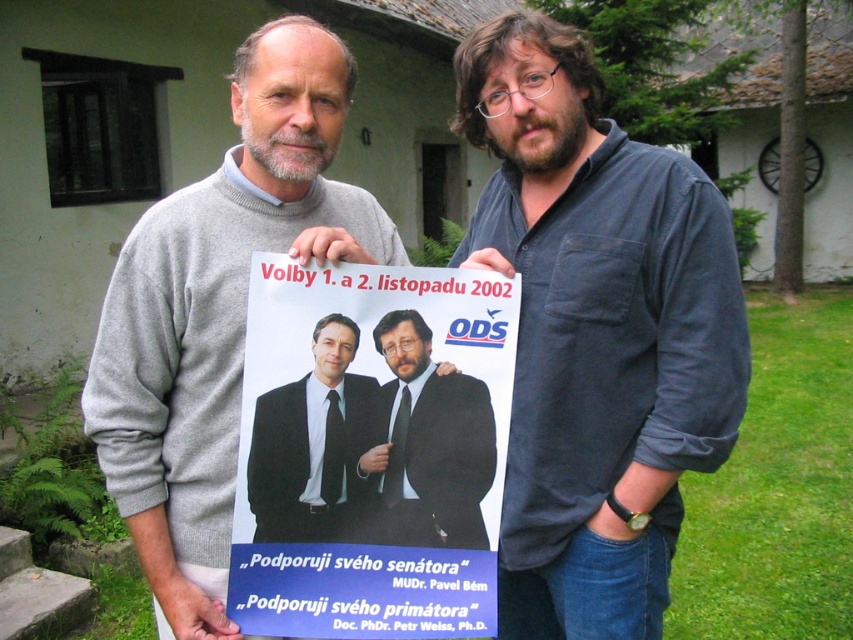
Question: Does blue paper poster at center have a larger size compared to gray sweater at center?

Choices:
 (A) no
 (B) yes

Answer: (A)

Question: Which object is closer to the camera taking this photo?

Choices:
 (A) matte black suit at center
 (B) black suit at center
 (C) gray sweater at center
 (D) blue paper poster at center

Answer: (D)

Question: Which object is closer to the camera taking this photo?

Choices:
 (A) matte black suit at center
 (B) dark blue shirt at center
 (C) blue paper poster at center

Answer: (C)

Question: Which point is closer to the camera?

Choices:
 (A) (569, 76)
 (B) (323, 384)

Answer: (B)

Question: Does gray sweater at center appear under matte black suit at center?

Choices:
 (A) no
 (B) yes

Answer: (A)

Question: Does blue paper poster at center appear on the left side of matte black suit at center?

Choices:
 (A) no
 (B) yes

Answer: (B)